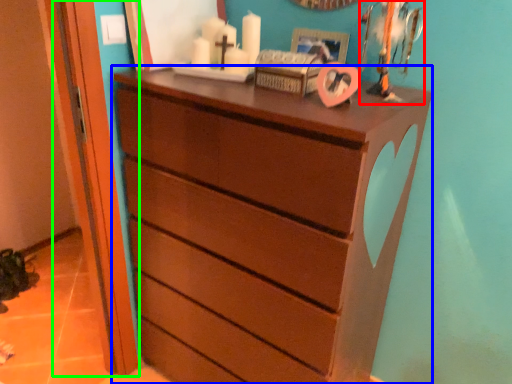
Question: Estimate the real-world distances between objects in this image. Which object is closer to toy (highlighted by a red box), chest of drawers (highlighted by a blue box) or door (highlighted by a green box)?

Choices:
 (A) chest of drawers
 (B) door

Answer: (A)